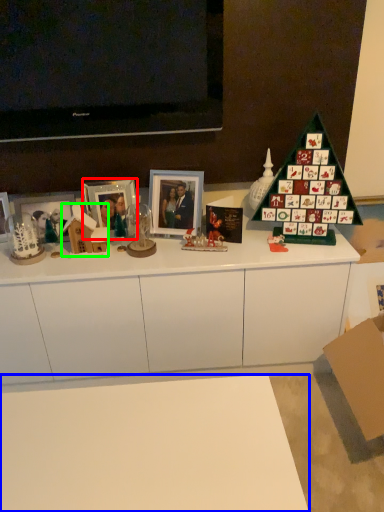
Question: Which object is the farthest from picture frame (highlighted by a red box)? Choose among these: desk (highlighted by a blue box) or toy (highlighted by a green box).

Choices:
 (A) desk
 (B) toy

Answer: (A)